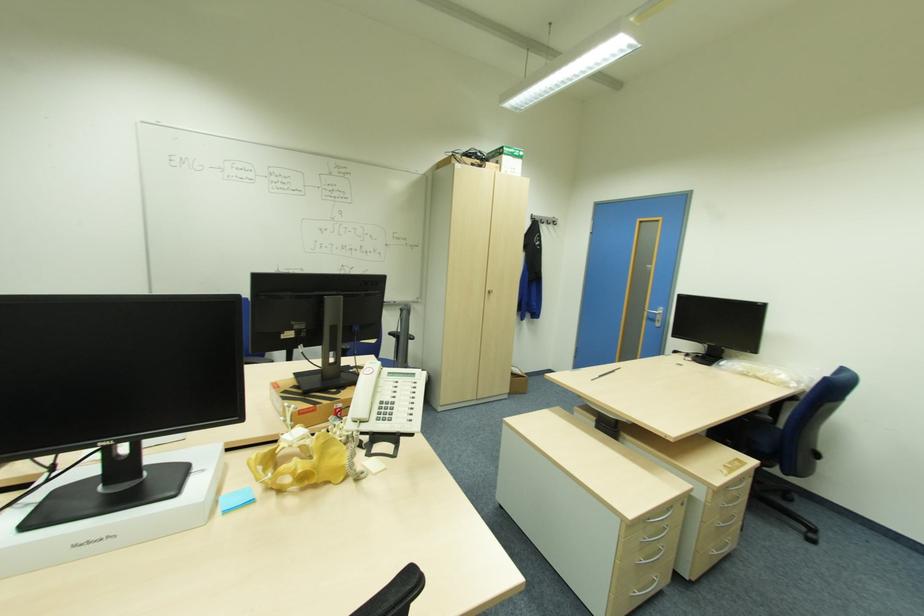
Find where to sit the chair sitting surface. Please return your answer as a coordinate pair (x, y).

(757, 436)